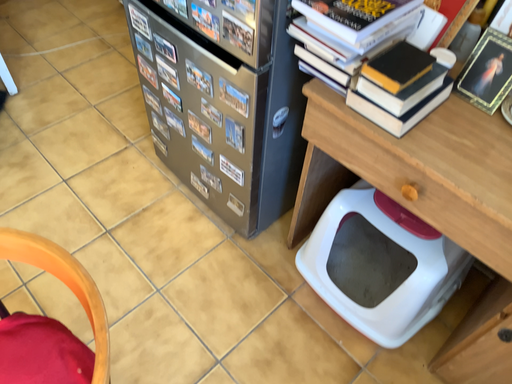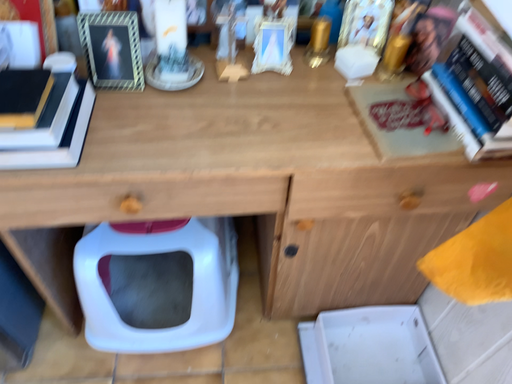
Question: How did the camera likely rotate when shooting the video?

Choices:
 (A) rotated downward
 (B) rotated upward

Answer: (B)